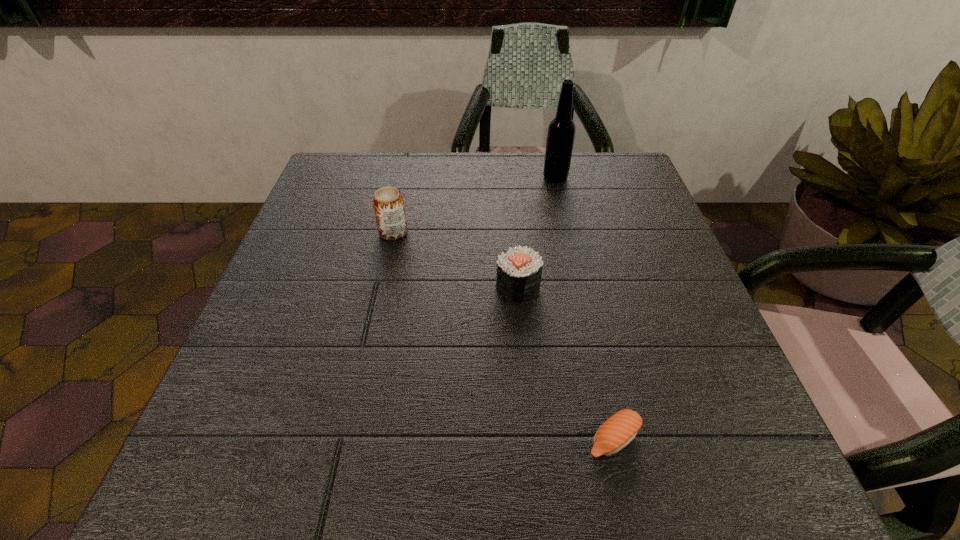
The width and height of the screenshot is (960, 540). I want to click on vacant space located on the left of the farther sushi, so click(x=449, y=287).

The width and height of the screenshot is (960, 540). I want to click on vacant region located 0.340m on the left of the nearer sushi, so click(351, 439).

This screenshot has height=540, width=960. What are the coordinates of `object that is positioned at the far edge` in the screenshot? It's located at (561, 132).

Locate an element on the screen. The width and height of the screenshot is (960, 540). object present at the near edge is located at coordinates (620, 429).

At what (x,y) coordinates should I click in order to perform the action: click on vacant space at the far edge. Please return your answer as a coordinate pair (x, y). The width and height of the screenshot is (960, 540). Looking at the image, I should click on (432, 160).

Where is `free region at the near edge`? free region at the near edge is located at coordinates (494, 445).

In the image, there is a desktop. Where is `vacant space at the left edge`? vacant space at the left edge is located at coordinates (311, 382).

Find the location of a particular element. Image resolution: width=960 pixels, height=540 pixels. vacant space at the right edge is located at coordinates (708, 408).

At what (x,y) coordinates should I click in order to perform the action: click on vacant region at the far left corner of the desktop. Please return your answer as a coordinate pair (x, y). This screenshot has height=540, width=960. Looking at the image, I should click on (348, 160).

I want to click on free location at the near left corner, so click(262, 496).